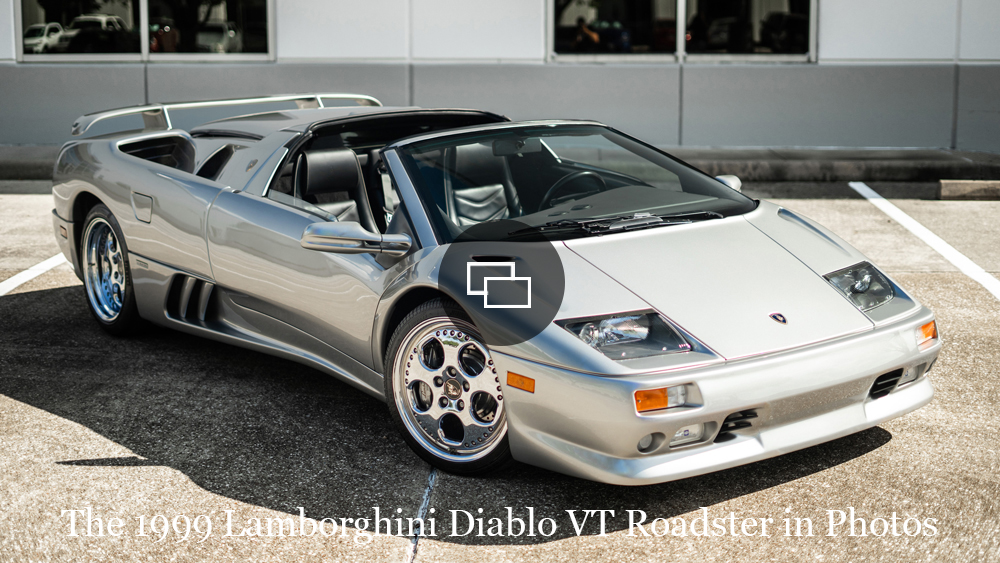
You are a GUI agent. You are given a task and a screenshot of the screen. Output one action in this format:
    pyautogui.click(x=<x>, y=<y>)
    Task: Click on the light
    
    Given the screenshot: What is the action you would take?
    pyautogui.click(x=865, y=278)